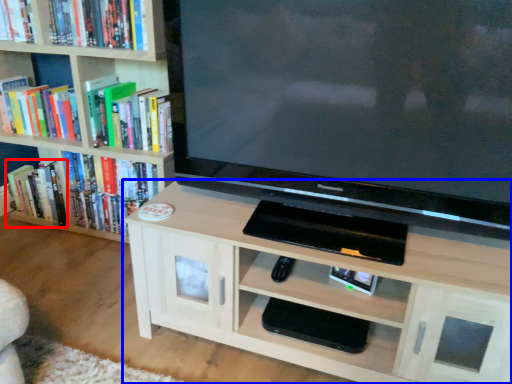
Question: Which object is further to the camera taking this photo, book (highlighted by a red box) or shelf (highlighted by a blue box)?

Choices:
 (A) book
 (B) shelf

Answer: (A)